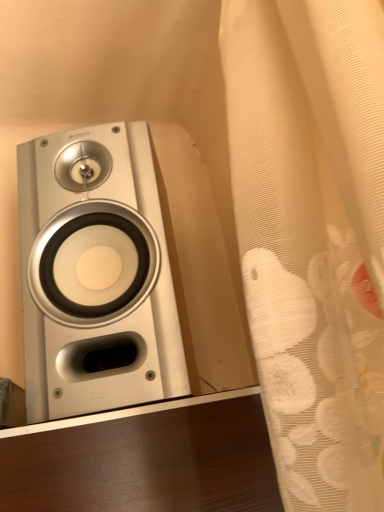
Question: Would you say white sheer curtain at right is to the left or to the right of silver metallic speaker at left in the picture?

Choices:
 (A) right
 (B) left

Answer: (A)

Question: Considering their positions, is white sheer curtain at right located in front of or behind silver metallic speaker at left?

Choices:
 (A) front
 (B) behind

Answer: (A)

Question: Is white sheer curtain at right bigger or smaller than silver metallic speaker at left?

Choices:
 (A) big
 (B) small

Answer: (B)

Question: From their relative heights in the image, would you say silver metallic speaker at left is taller or shorter than white sheer curtain at right?

Choices:
 (A) tall
 (B) short

Answer: (B)

Question: Considering their positions, is silver metallic speaker at left located in front of or behind white sheer curtain at right?

Choices:
 (A) behind
 (B) front

Answer: (A)

Question: Considering the positions of point (144, 285) and point (327, 368), is point (144, 285) closer or farther from the camera than point (327, 368)?

Choices:
 (A) farther
 (B) closer

Answer: (A)

Question: Would you say silver metallic speaker at left is to the left or to the right of white sheer curtain at right in the picture?

Choices:
 (A) right
 (B) left

Answer: (B)